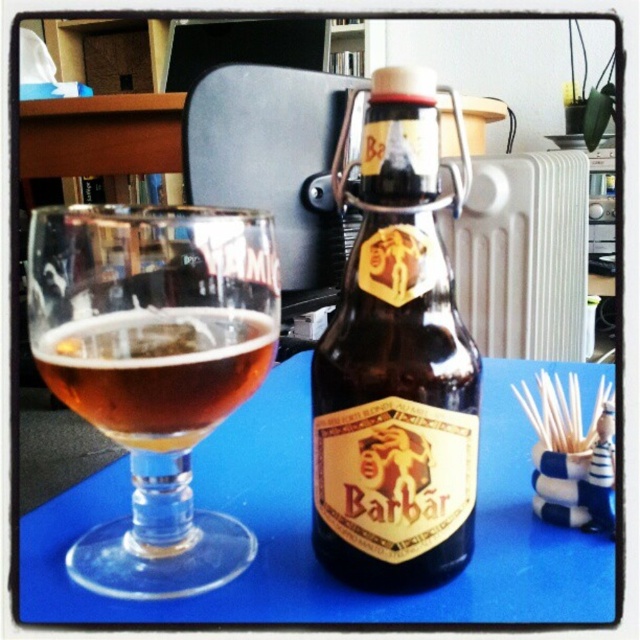
You are organizing a small party and need to place decorations on the blue matte table at center and the white metallic radiator at center right. Which surface has more space available for decorations?

The white metallic radiator at center right has more space available because the blue matte table at center occupies less space than it.

You are organizing a dinner party and need to arrange the transparent glass wine glass at left and the amber glass at center on a shelf. According to their positions in the image, which glass should be placed higher on the shelf?

The transparent glass wine glass at left should be placed higher on the shelf since it is located above the amber glass at center in the image.